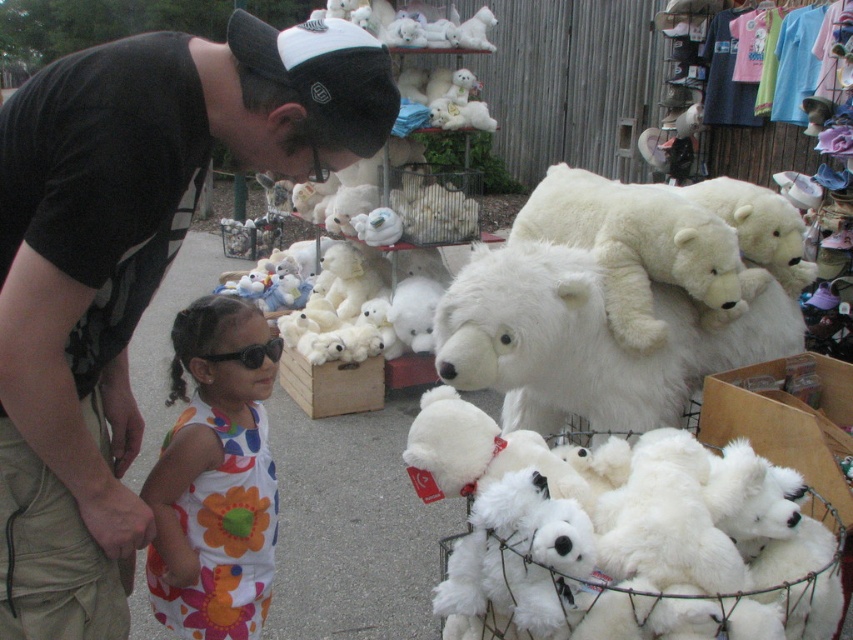
You are standing in the market scene and want to determine which of the two points, point (x=233, y=516) or point (x=627, y=333), is nearer to you. Based on the spatial arrangement, which point is closer?

Point (x=233, y=516) is closer to the viewer than point (x=627, y=333).

You are a customer at the market and you want to buy the white plush bear at center. The vendor tells you that the price is displayed on the black fabric cap at upper center. Can you see the price?

The black fabric cap at upper center is much taller than the white plush bear at center, so it is possible that the price displayed on the black fabric cap at upper center is visible from your position.

Consider the image. You are standing in the market scene and want to find the floral fabric dress at lower left. According to the coordinates given, where should you look relative to the center of the image?

The floral fabric dress at lower left is located at coordinates point [215,476], which is to the lower left of the image center.